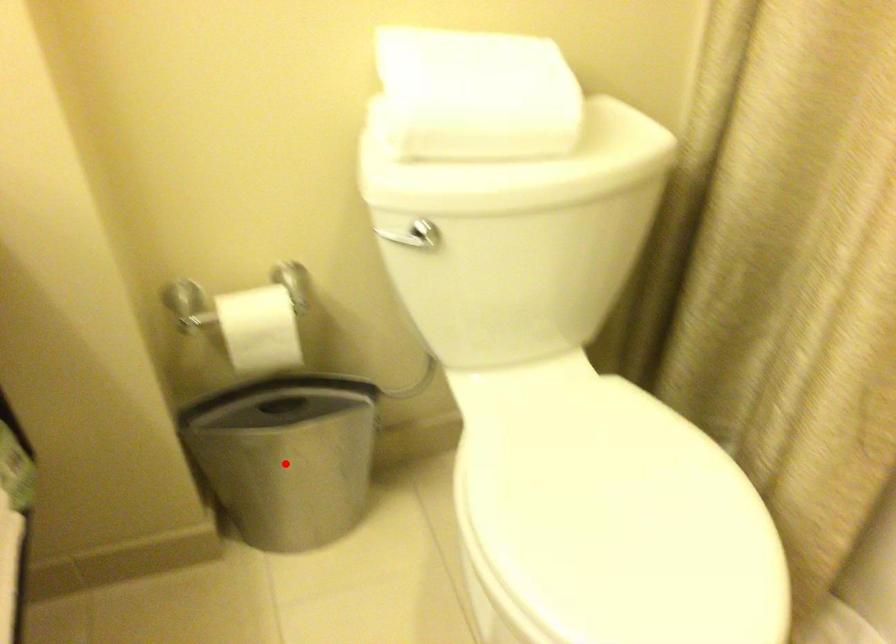
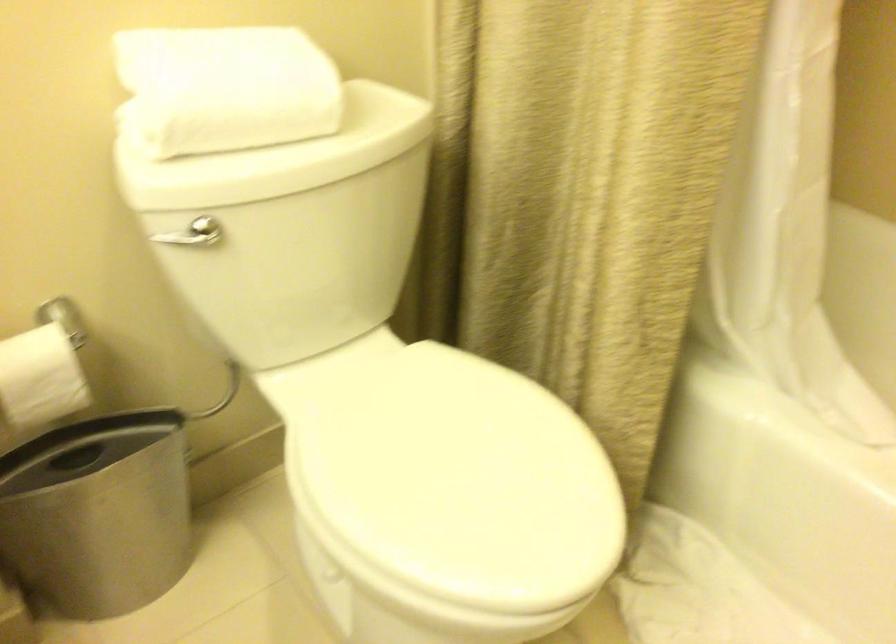
Where in the second image is the point corresponding to the highlighted location from the first image?

(98, 514)